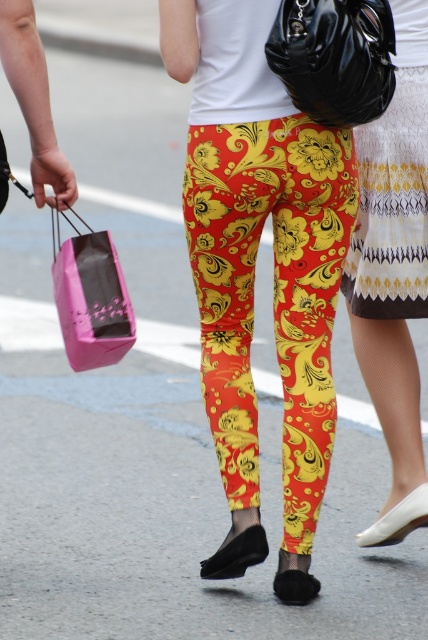
You are a fashion designer observing the scene. You notice the printed fabric skirt at center and the white textured dress at upper right. Which clothing item is closer to the camera?

The printed fabric skirt at center is closer to the camera because it is in front of the white textured dress at upper right.